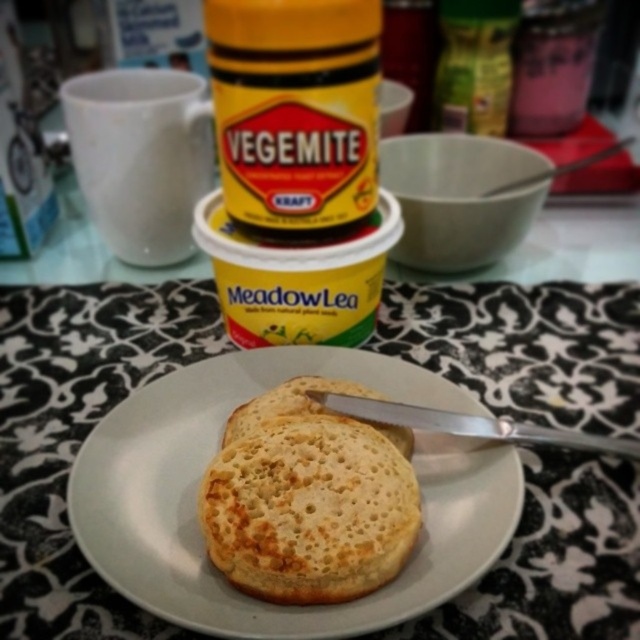
What do you see at coordinates (308, 509) in the screenshot?
I see `golden-brown crispy pancake at center` at bounding box center [308, 509].

Is point (396, 472) closer to camera compared to point (243, 406)?

Yes, point (396, 472) is closer to viewer.

In order to click on golden-brown crispy pancake at center in this screenshot , I will do `click(308, 509)`.

What are the coordinates of `white matte plate at center` in the screenshot? It's located at (212, 456).

Does point (253, 394) lie in front of point (273, 436)?

No, it is not.

Is point (188, 588) more distant than point (291, 598)?

Yes.

The width and height of the screenshot is (640, 640). Find the location of `white matte plate at center`. white matte plate at center is located at coordinates (212, 456).

Is point (112, 528) positioned behind point (195, 179)?

No, (112, 528) is closer to viewer.

Can you confirm if white matte plate at center is bigger than white matte mug at upper left?

Actually, white matte plate at center might be smaller than white matte mug at upper left.

The height and width of the screenshot is (640, 640). In order to click on white matte plate at center in this screenshot , I will do `click(212, 456)`.

This screenshot has height=640, width=640. Find the location of `white matte plate at center`. white matte plate at center is located at coordinates click(212, 456).